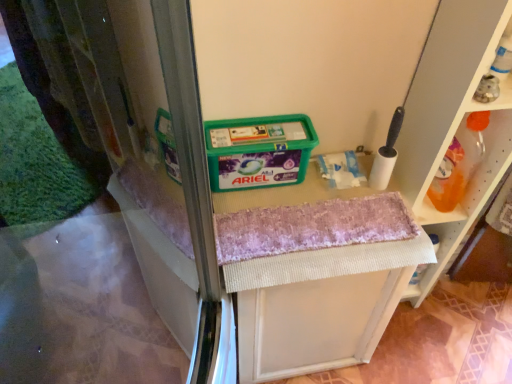
Question: Is translucent plastic bottle at upper right, the first shelf in the back-to-front sequence, taller than white plastic shelf at right, which is counted as the first shelf, starting from the front?

Choices:
 (A) yes
 (B) no

Answer: (B)

Question: Is translucent plastic bottle at upper right, the first shelf in the back-to-front sequence, further to the viewer compared to white plastic shelf at right, which is counted as the first shelf, starting from the front?

Choices:
 (A) yes
 (B) no

Answer: (A)

Question: From the image's perspective, is translucent plastic bottle at upper right, the first shelf in the back-to-front sequence, under white plastic shelf at right, arranged as the 2th shelf when viewed from the back?

Choices:
 (A) no
 (B) yes

Answer: (A)

Question: Considering the relative positions of translucent plastic bottle at upper right, the first shelf in the back-to-front sequence, and white plastic shelf at right, which is counted as the first shelf, starting from the front, in the image provided, is translucent plastic bottle at upper right, the first shelf in the back-to-front sequence, in front of white plastic shelf at right, which is counted as the first shelf, starting from the front,?

Choices:
 (A) no
 (B) yes

Answer: (A)

Question: Can you confirm if translucent plastic bottle at upper right, the first shelf in the back-to-front sequence, is thinner than white plastic shelf at right, which is counted as the first shelf, starting from the front?

Choices:
 (A) no
 (B) yes

Answer: (B)

Question: In the image, is white foam brush at upper right positioned in front of or behind textured fabric vanity at center?

Choices:
 (A) front
 (B) behind

Answer: (A)

Question: Considering the positions of point (395, 109) and point (244, 294), is point (395, 109) closer or farther from the camera than point (244, 294)?

Choices:
 (A) farther
 (B) closer

Answer: (A)

Question: Based on their sizes in the image, would you say white foam brush at upper right is bigger or smaller than textured fabric vanity at center?

Choices:
 (A) big
 (B) small

Answer: (B)

Question: From a real-world perspective, is white foam brush at upper right positioned above or below textured fabric vanity at center?

Choices:
 (A) below
 (B) above

Answer: (B)

Question: In the image, is white plastic shelf at right, arranged as the 2th shelf when viewed from the back, positioned in front of or behind translucent plastic bottle at upper right, acting as the second shelf starting from the front?

Choices:
 (A) behind
 (B) front

Answer: (B)

Question: Does point (428, 274) appear closer or farther from the camera than point (501, 160)?

Choices:
 (A) closer
 (B) farther

Answer: (B)

Question: From their relative heights in the image, would you say white plastic shelf at right, which is counted as the first shelf, starting from the front, is taller or shorter than translucent plastic bottle at upper right, the first shelf in the back-to-front sequence?

Choices:
 (A) tall
 (B) short

Answer: (A)

Question: Is white plastic shelf at right, arranged as the 2th shelf when viewed from the back, inside or outside of translucent plastic bottle at upper right, acting as the second shelf starting from the front?

Choices:
 (A) inside
 (B) outside

Answer: (B)

Question: Is pink textured bath towel at center to the left or to the right of white foam brush at upper right in the image?

Choices:
 (A) right
 (B) left

Answer: (B)

Question: From the image's perspective, relative to white foam brush at upper right, is pink textured bath towel at center above or below?

Choices:
 (A) below
 (B) above

Answer: (A)